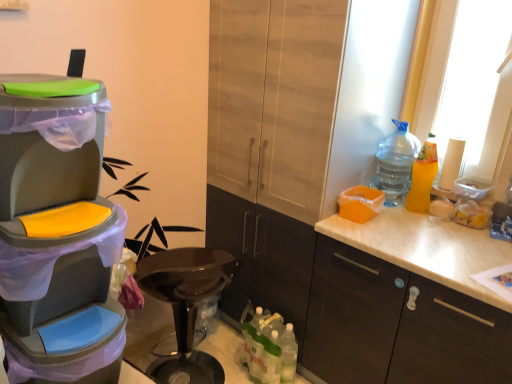
Identify the location of space that is in front of yellow matte bottle at right, the 2th bottle in the bottom-to-top sequence. This screenshot has height=384, width=512. (426, 227).